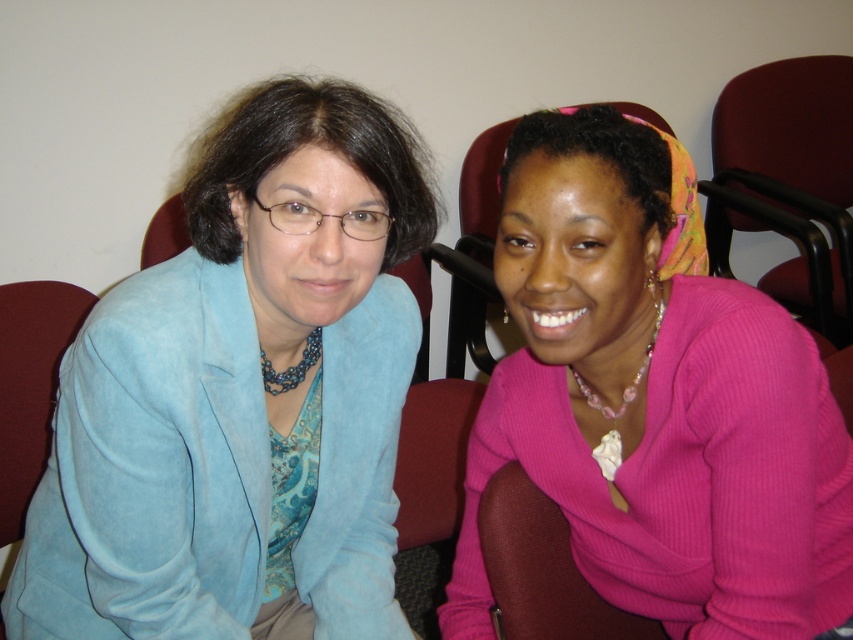
Who is higher up, suede blue blazer at left or maroon leather chair at right?

maroon leather chair at right is above.

How far apart are suede blue blazer at left and maroon leather chair at right?

suede blue blazer at left is 4.77 feet from maroon leather chair at right.

The image size is (853, 640). Identify the location of suede blue blazer at left. (242, 394).

You are a GUI agent. You are given a task and a screenshot of the screen. Output one action in this format:
    pyautogui.click(x=<x>, y=<y>)
    Task: Click on the suede blue blazer at left
    
    Given the screenshot: What is the action you would take?
    pyautogui.click(x=242, y=394)

How far apart are pink ribbed sweater at center and maroon leather chair at right?

A distance of 4.23 feet exists between pink ribbed sweater at center and maroon leather chair at right.

Does pink ribbed sweater at center have a larger size compared to maroon leather chair at right?

No.

Who is more forward, (509, 432) or (827, 193)?

Point (509, 432)

Locate an element on the screen. pink ribbed sweater at center is located at coordinates (654, 404).

Is suede blue blazer at left thinner than pink ribbed sweater at center?

No.

Does suede blue blazer at left have a larger size compared to pink ribbed sweater at center?

Yes.

Is point (231, 436) in front of point (546, 212)?

No, it is not.

Image resolution: width=853 pixels, height=640 pixels. I want to click on suede blue blazer at left, so click(242, 394).